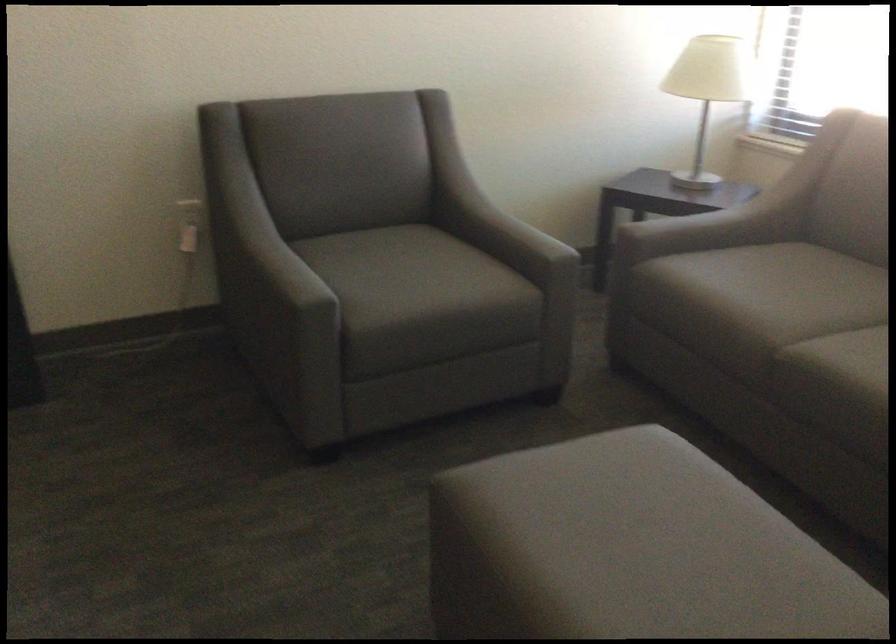
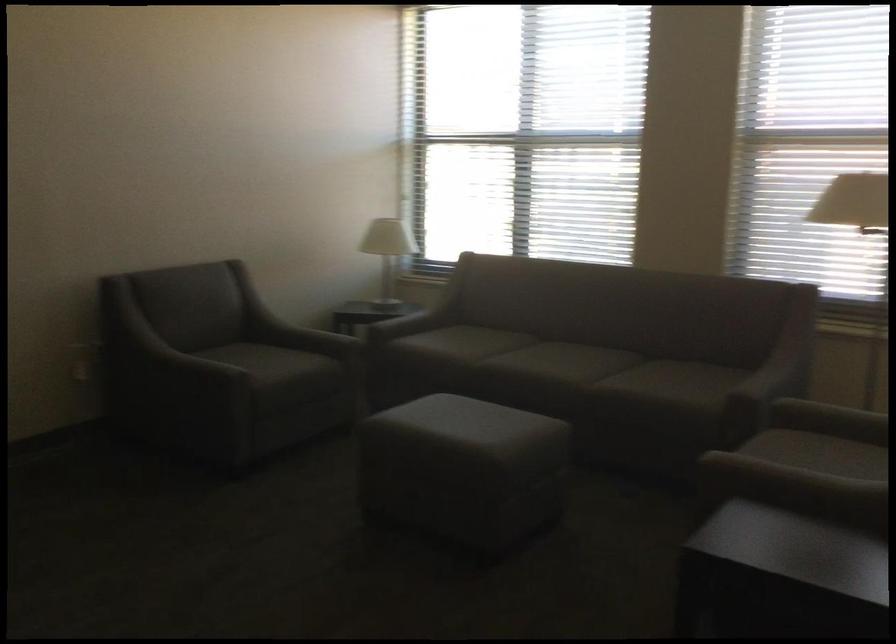
In the second image, find the point that corresponds to (401,272) in the first image.

(259, 359)